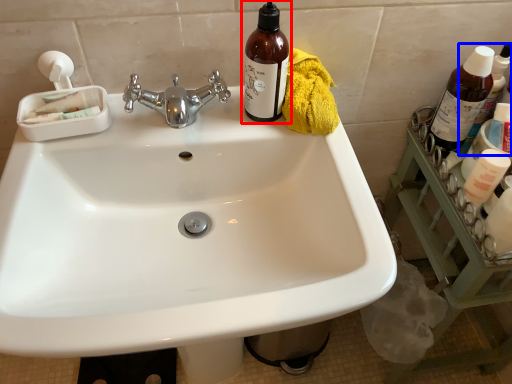
Question: Which of the following is the closest to the observer, bottle (highlighted by a red box) or bottle (highlighted by a blue box)?

Choices:
 (A) bottle
 (B) bottle

Answer: (A)